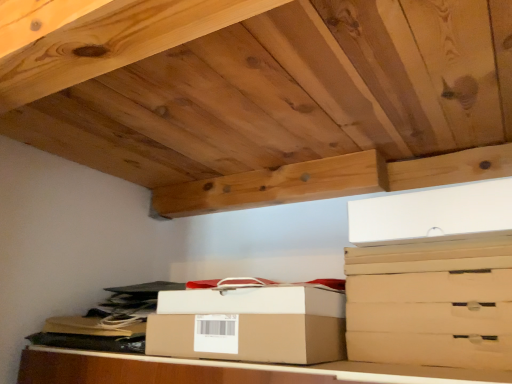
How much space does brown cardboard drawer at lower right, which is the 4th drawer in top-to-bottom order, occupy horizontally?

brown cardboard drawer at lower right, which is the 4th drawer in top-to-bottom order, is 13.03 inches in width.

Measure the distance between point (x=295, y=362) and camera.

Point (x=295, y=362) is 72.40 centimeters away from camera.

Image resolution: width=512 pixels, height=384 pixels. What do you see at coordinates (250, 325) in the screenshot?
I see `brown cardboard box at center, acting as the first box starting from the bottom` at bounding box center [250, 325].

Find the location of a particular element. The width and height of the screenshot is (512, 384). brown cardboard drawer at lower right, arranged as the 1th drawer when ordered from the bottom is located at coordinates (431, 349).

Which of these two, matte cardboard drawer at lower right, the second drawer when ordered from bottom to top, or brown cardboard drawer at right, the 1th drawer positioned from the top, is smaller?

brown cardboard drawer at right, the 1th drawer positioned from the top, is smaller.

Could you measure the distance between matte cardboard drawer at lower right, the third drawer viewed from the top, and brown cardboard drawer at right, acting as the 4th drawer starting from the bottom?

matte cardboard drawer at lower right, the third drawer viewed from the top, is 3.16 inches from brown cardboard drawer at right, acting as the 4th drawer starting from the bottom.

What's the angular difference between matte cardboard drawer at lower right, the third drawer viewed from the top, and brown cardboard drawer at right, acting as the 4th drawer starting from the bottom,'s facing directions?

matte cardboard drawer at lower right, the third drawer viewed from the top, and brown cardboard drawer at right, acting as the 4th drawer starting from the bottom, are facing 0.000189 degrees away from each other.

Can brown cardboard drawer at right, acting as the 4th drawer starting from the bottom, be found inside matte cardboard drawer at lower right, the second drawer when ordered from bottom to top?

No, brown cardboard drawer at right, acting as the 4th drawer starting from the bottom, is not a part of matte cardboard drawer at lower right, the second drawer when ordered from bottom to top.

Is the depth of white cardboard box at center, which ranks as the 1th box in top-to-bottom order, less than that of brown cardboard drawer at lower right, arranged as the 1th drawer when ordered from the bottom?

No, it is not.

Is white cardboard box at center, which ranks as the 1th box in top-to-bottom order, spatially inside brown cardboard drawer at lower right, which is the 4th drawer in top-to-bottom order, or outside of it?

white cardboard box at center, which ranks as the 1th box in top-to-bottom order, is located beyond the bounds of brown cardboard drawer at lower right, which is the 4th drawer in top-to-bottom order.

Which is nearer, (x=300, y=286) or (x=405, y=352)?

Point (x=300, y=286) is positioned closer to the camera compared to point (x=405, y=352).

Who is taller, white cardboard box at center, which ranks as the 1th box in top-to-bottom order, or brown cardboard drawer at lower right, arranged as the 1th drawer when ordered from the bottom?

white cardboard box at center, which ranks as the 1th box in top-to-bottom order, is taller.

Can you confirm if brown cardboard box at center is shorter than brown cardboard drawer at lower right, arranged as the 1th drawer when ordered from the bottom?

No.

Is brown cardboard box at center turned away from brown cardboard drawer at lower right, which is the 4th drawer in top-to-bottom order?

No, brown cardboard box at center is not facing away from brown cardboard drawer at lower right, which is the 4th drawer in top-to-bottom order.

Does brown cardboard box at center appear on the right side of brown cardboard drawer at lower right, which is the 4th drawer in top-to-bottom order?

No.

In the scene shown: Considering their positions, is brown cardboard box at center located in front of or behind brown cardboard drawer at lower right, arranged as the 1th drawer when ordered from the bottom?

In the image, brown cardboard box at center appears in front of brown cardboard drawer at lower right, arranged as the 1th drawer when ordered from the bottom.

From the picture: Between white cardboard box at center, which ranks as the 1th box in top-to-bottom order, and matte cardboard drawer at center right, the 3th drawer when ordered from bottom to top, which one appears on the left side from the viewer's perspective?

Positioned to the left is white cardboard box at center, which ranks as the 1th box in top-to-bottom order.

From the image's perspective, relative to matte cardboard drawer at center right, the 3th drawer when ordered from bottom to top, is white cardboard box at center, which ranks as the 1th box in top-to-bottom order, above or below?

white cardboard box at center, which ranks as the 1th box in top-to-bottom order, is below matte cardboard drawer at center right, the 3th drawer when ordered from bottom to top.

Based on their sizes in the image, would you say white cardboard box at center, which ranks as the 1th box in top-to-bottom order, is bigger or smaller than matte cardboard drawer at center right, the 2th drawer positioned from the top?

Clearly, white cardboard box at center, which ranks as the 1th box in top-to-bottom order, is smaller in size than matte cardboard drawer at center right, the 2th drawer positioned from the top.

In terms of height, does white cardboard box at center, positioned as the 2th box in bottom-to-top order, look taller or shorter compared to matte cardboard drawer at center right, the 3th drawer when ordered from bottom to top?

Considering their sizes, white cardboard box at center, positioned as the 2th box in bottom-to-top order, has more height than matte cardboard drawer at center right, the 3th drawer when ordered from bottom to top.

Looking at this image, is brown cardboard box at center at the back of matte cardboard drawer at lower right, the third drawer viewed from the top?

No.

From a real-world perspective, between matte cardboard drawer at lower right, the third drawer viewed from the top, and brown cardboard box at center, who is vertically lower?

brown cardboard box at center, from a real-world perspective.

Is matte cardboard drawer at lower right, the second drawer when ordered from bottom to top, to the right of brown cardboard box at center from the viewer's perspective?

Correct, you'll find matte cardboard drawer at lower right, the second drawer when ordered from bottom to top, to the right of brown cardboard box at center.

Is the depth of matte cardboard drawer at lower right, the third drawer viewed from the top, less than that of brown cardboard box at center?

No, matte cardboard drawer at lower right, the third drawer viewed from the top, is further to the viewer.

Is matte cardboard drawer at center right, the 3th drawer when ordered from bottom to top, closer to camera compared to white cardboard box at center, which ranks as the 1th box in top-to-bottom order?

Yes, the depth of matte cardboard drawer at center right, the 3th drawer when ordered from bottom to top, is less than that of white cardboard box at center, which ranks as the 1th box in top-to-bottom order.

Does matte cardboard drawer at center right, the 2th drawer positioned from the top, have a greater width compared to white cardboard box at center, which ranks as the 1th box in top-to-bottom order?

Yes, matte cardboard drawer at center right, the 2th drawer positioned from the top, is wider than white cardboard box at center, which ranks as the 1th box in top-to-bottom order.

From the image's perspective, which box is the 1st one below the matte cardboard drawer at center right, the 3th drawer when ordered from bottom to top? Please provide its 2D coordinates.

[(254, 301)]

From the image's perspective, between matte cardboard drawer at center right, the 2th drawer positioned from the top, and white cardboard box at center, which ranks as the 1th box in top-to-bottom order, who is located below?

white cardboard box at center, which ranks as the 1th box in top-to-bottom order, is shown below in the image.

From the image's perspective, which object appears higher, matte cardboard drawer at lower right, the third drawer viewed from the top, or white cardboard box at center, positioned as the 2th box in bottom-to-top order?

From the image's view, white cardboard box at center, positioned as the 2th box in bottom-to-top order, is above.

Is there a large distance between matte cardboard drawer at lower right, the third drawer viewed from the top, and white cardboard box at center, positioned as the 2th box in bottom-to-top order?

No, matte cardboard drawer at lower right, the third drawer viewed from the top, is not far from white cardboard box at center, positioned as the 2th box in bottom-to-top order.

Does matte cardboard drawer at lower right, the second drawer when ordered from bottom to top, appear on the right side of white cardboard box at center, positioned as the 2th box in bottom-to-top order?

Correct, you'll find matte cardboard drawer at lower right, the second drawer when ordered from bottom to top, to the right of white cardboard box at center, positioned as the 2th box in bottom-to-top order.

What are the coordinates of `the 2nd drawer in front when counting from the matte cardboard drawer at lower right, the third drawer viewed from the top` in the screenshot? It's located at (430, 265).

Locate an element on the screen. Image resolution: width=512 pixels, height=384 pixels. drawer that is the 1st object to the right of the white cardboard box at center, which ranks as the 1th box in top-to-bottom order, starting at the anchor is located at coordinates (431, 349).

Based on their spatial positions, is brown cardboard drawer at lower right, which is the 4th drawer in top-to-bottom order, or white cardboard box at center, positioned as the 2th box in bottom-to-top order, further from matte cardboard drawer at center right, the 3th drawer when ordered from bottom to top?

The object further to matte cardboard drawer at center right, the 3th drawer when ordered from bottom to top, is white cardboard box at center, positioned as the 2th box in bottom-to-top order.

Based on their spatial positions, is brown cardboard box at center or white cardboard box at center, positioned as the 2th box in bottom-to-top order, closer to brown cardboard drawer at right, the 1th drawer positioned from the top?

Based on the image, white cardboard box at center, positioned as the 2th box in bottom-to-top order, appears to be nearer to brown cardboard drawer at right, the 1th drawer positioned from the top.

Based on the photo, from the image, which object appears to be farther from white cardboard box at center, positioned as the 2th box in bottom-to-top order, matte cardboard drawer at center right, the 2th drawer positioned from the top, or brown cardboard drawer at right, the 1th drawer positioned from the top?

brown cardboard drawer at right, the 1th drawer positioned from the top, is positioned further to the anchor white cardboard box at center, positioned as the 2th box in bottom-to-top order.

From the image, which object appears to be nearer to matte cardboard drawer at center right, the 2th drawer positioned from the top, brown cardboard drawer at right, the 1th drawer positioned from the top, or brown cardboard drawer at lower right, arranged as the 1th drawer when ordered from the bottom?

brown cardboard drawer at right, the 1th drawer positioned from the top.

From the image, which object appears to be farther from brown cardboard box at center, marked as the second box in a top-to-bottom arrangement, matte cardboard drawer at lower right, the third drawer viewed from the top, or brown cardboard drawer at right, acting as the 4th drawer starting from the bottom?

brown cardboard drawer at right, acting as the 4th drawer starting from the bottom, is further to brown cardboard box at center, marked as the second box in a top-to-bottom arrangement.

Estimate the real-world distances between objects in this image. Which object is further from brown cardboard drawer at right, the 1th drawer positioned from the top, matte cardboard drawer at center right, the 2th drawer positioned from the top, or white cardboard box at center, positioned as the 2th box in bottom-to-top order?

Among the two, white cardboard box at center, positioned as the 2th box in bottom-to-top order, is located further to brown cardboard drawer at right, the 1th drawer positioned from the top.

From the image, which object appears to be nearer to matte cardboard drawer at lower right, the third drawer viewed from the top, white cardboard box at center, which ranks as the 1th box in top-to-bottom order, or brown cardboard box at center?

The object closer to matte cardboard drawer at lower right, the third drawer viewed from the top, is white cardboard box at center, which ranks as the 1th box in top-to-bottom order.

In the scene shown: Considering their positions, is matte cardboard drawer at lower right, the second drawer when ordered from bottom to top, positioned further to brown cardboard drawer at right, the 1th drawer positioned from the top, than white cardboard box at center, positioned as the 2th box in bottom-to-top order?

white cardboard box at center, positioned as the 2th box in bottom-to-top order, is positioned further to the anchor brown cardboard drawer at right, the 1th drawer positioned from the top.

Find the location of a particular element. furniture between white cardboard box at center, which ranks as the 1th box in top-to-bottom order, and brown cardboard drawer at right, the 1th drawer positioned from the top, from left to right is located at coordinates [224, 370].

I want to click on furniture located between white cardboard box at center, which ranks as the 1th box in top-to-bottom order, and matte cardboard drawer at center right, the 2th drawer positioned from the top, in the left-right direction, so click(224, 370).

Find the location of a particular element. This screenshot has width=512, height=384. furniture situated between brown cardboard box at center, acting as the first box starting from the bottom, and matte cardboard drawer at lower right, the third drawer viewed from the top, from left to right is located at coordinates (224, 370).

Locate an element on the screen. drawer between brown cardboard box at center, acting as the first box starting from the bottom, and matte cardboard drawer at lower right, the third drawer viewed from the top, from left to right is located at coordinates (431, 349).